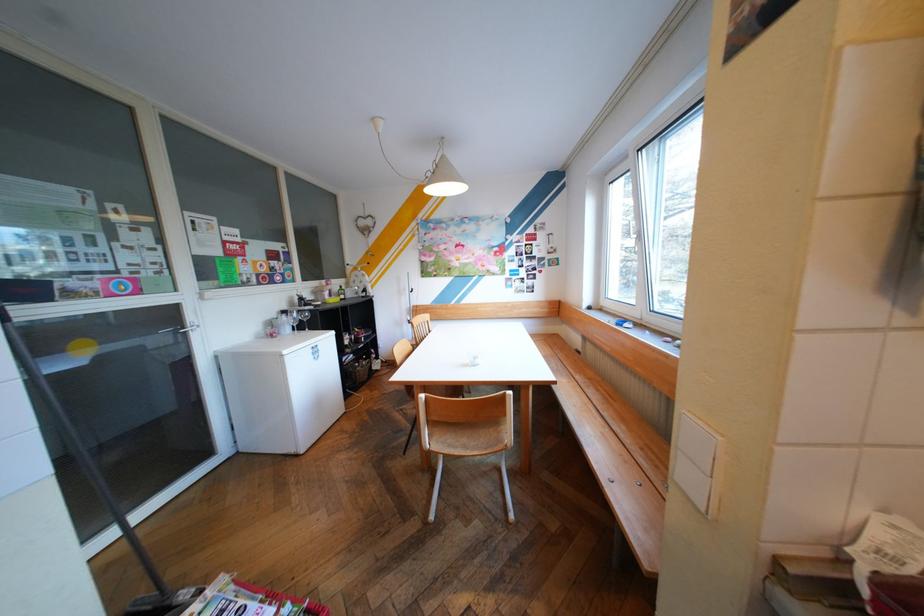
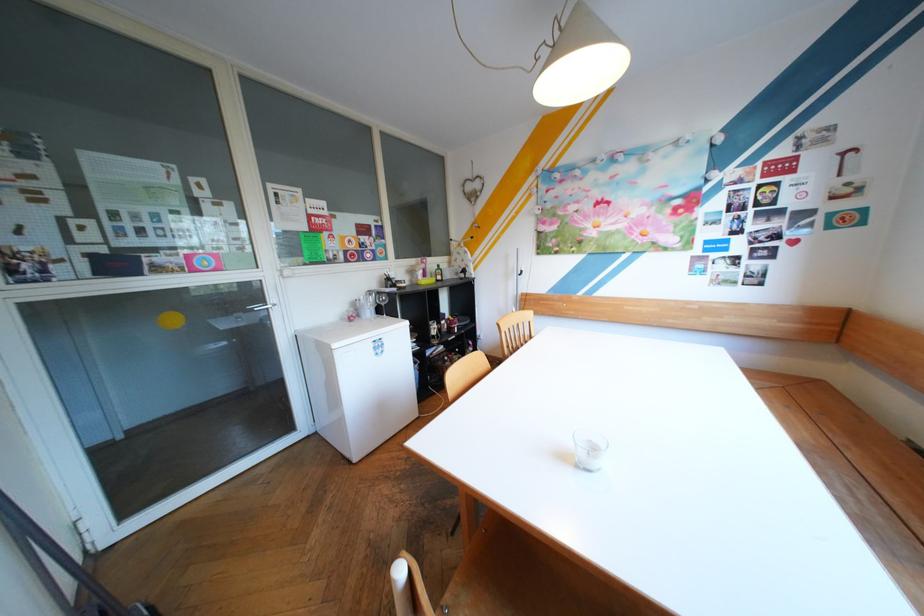
Locate, in the second image, the point that corresponds to [329,283] in the first image.

(426, 261)